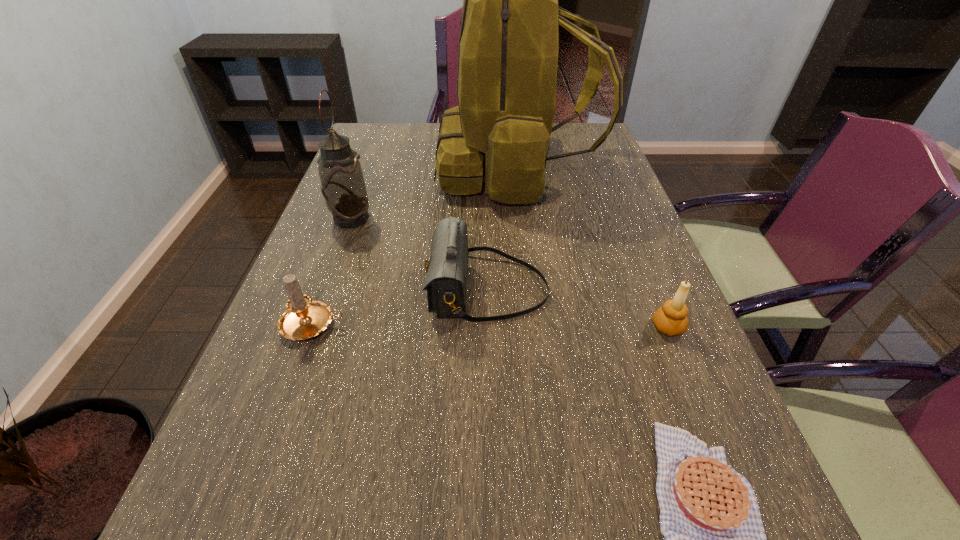
You are a GUI agent. You are given a task and a screenshot of the screen. Output one action in this format:
    pyautogui.click(x=<x>, y=<y>)
    Task: Click on the free space at the left edge of the desktop
    The height and width of the screenshot is (540, 960).
    Given the screenshot: What is the action you would take?
    pyautogui.click(x=340, y=235)

The height and width of the screenshot is (540, 960). Find the location of `vacant space at the right edge of the desktop`. vacant space at the right edge of the desktop is located at coordinates (616, 298).

Where is `vacant region between the candle and the oil lamp`? Image resolution: width=960 pixels, height=540 pixels. vacant region between the candle and the oil lamp is located at coordinates (332, 272).

The height and width of the screenshot is (540, 960). What are the coordinates of `unoccupied position between the oil lamp and the fourth shortest object` in the screenshot? It's located at (420, 254).

Identify the location of vacant space that is in between the candle and the fifth shortest object. (332, 272).

Identify the location of empty location between the backpack and the shoulder bag. (502, 229).

Where is `free spot between the candle and the fourth shortest object`? free spot between the candle and the fourth shortest object is located at coordinates (400, 307).

Locate an element on the screen. empty space that is in between the candle and the candle_holder is located at coordinates (491, 326).

Locate an element on the screen. free space between the shoulder bag and the tallest object is located at coordinates (502, 229).

This screenshot has width=960, height=540. I want to click on object that is the closest to the oil lamp, so click(x=508, y=48).